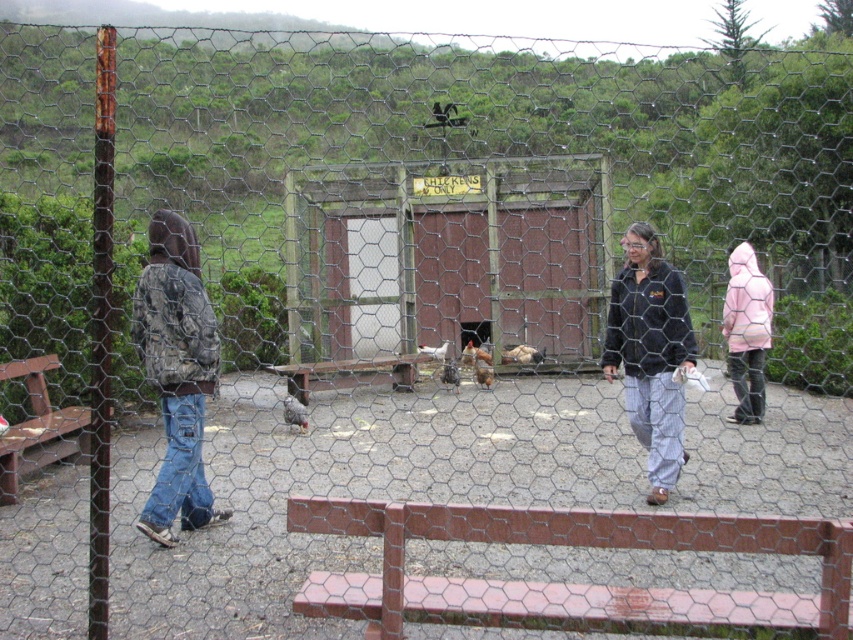
Question: Based on their relative distances, which object is nearer to the brown wooden bench at center?

Choices:
 (A) brown feathered chicken at center
 (B) pink matte jacket at right

Answer: (A)

Question: Which point is farther from the camera taking this photo?

Choices:
 (A) (647, 323)
 (B) (425, 348)
 (C) (744, 362)

Answer: (B)

Question: From the image, what is the correct spatial relationship of black textured jacket at center in relation to gray fur cat at center?

Choices:
 (A) left
 (B) right

Answer: (B)

Question: Is wooden chicken coop at center further to camera compared to brown feathered chicken at center?

Choices:
 (A) no
 (B) yes

Answer: (B)

Question: Which of the following is the farthest from the observer?

Choices:
 (A) brown wooden bench at center
 (B) gray fur cat at center
 (C) camouflage jacket at left

Answer: (A)

Question: Is wooden chicken coop at center smaller than pink matte jacket at right?

Choices:
 (A) no
 (B) yes

Answer: (A)